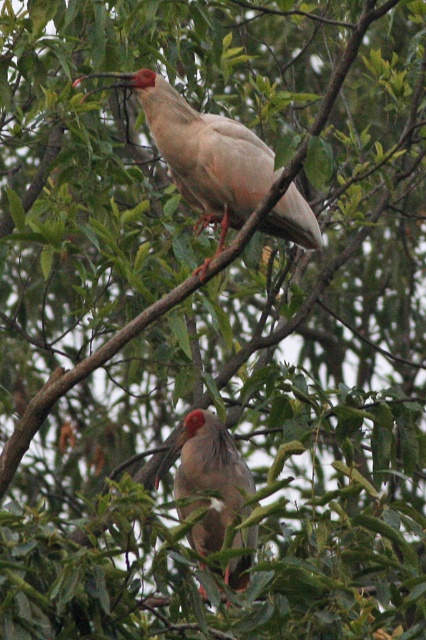
Question: Does matte white bird at upper center appear on the left side of matte gray bird at center?

Choices:
 (A) no
 (B) yes

Answer: (B)

Question: Among these objects, which one is farthest from the camera?

Choices:
 (A) matte gray bird at center
 (B) matte white bird at upper center

Answer: (B)

Question: Which of the following is the farthest from the observer?

Choices:
 (A) matte white bird at upper center
 (B) matte gray bird at center

Answer: (A)

Question: Is matte white bird at upper center to the right of matte gray bird at center from the viewer's perspective?

Choices:
 (A) yes
 (B) no

Answer: (B)

Question: Does matte white bird at upper center appear under matte gray bird at center?

Choices:
 (A) yes
 (B) no

Answer: (B)